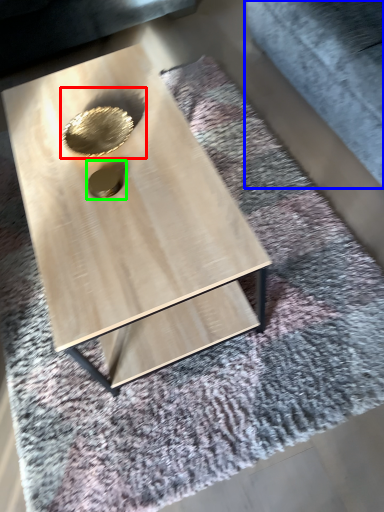
Question: Based on their relative distances, which object is farther from hole (highlighted by a red box)? Choose from gray (highlighted by a blue box) and hole (highlighted by a green box).

Choices:
 (A) gray
 (B) hole

Answer: (A)